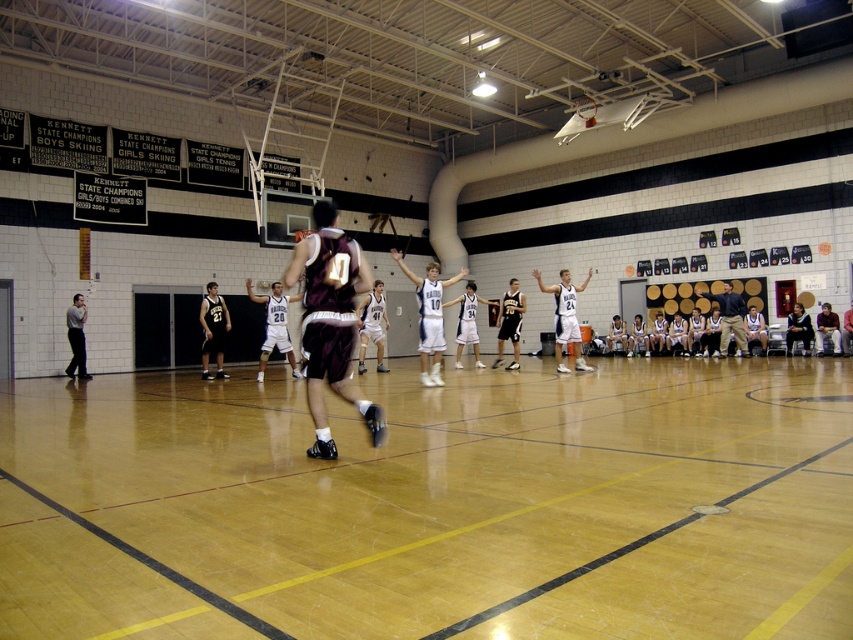
Question: Does wooden floor at center appear over matte black jersey at center?

Choices:
 (A) yes
 (B) no

Answer: (B)

Question: Is white jersey at center to the left of dark brown leather jacket at lower right from the viewer's perspective?

Choices:
 (A) yes
 (B) no

Answer: (A)

Question: Observing the image, what is the correct spatial positioning of dark blue shirt at right in reference to gray shirt at left?

Choices:
 (A) right
 (B) left

Answer: (A)

Question: Which of these objects is positioned closest to the white jersey at center?

Choices:
 (A) dark blue shirt at right
 (B) dark blue jersey at center
 (C) dark brown leather jacket at lower right

Answer: (A)

Question: Which point is closer to the camera taking this photo?

Choices:
 (A) (73, 305)
 (B) (720, 305)
 (C) (560, 342)

Answer: (C)

Question: Which point is closer to the camera taking this photo?

Choices:
 (A) (311, 332)
 (B) (68, 621)
 (C) (80, 362)

Answer: (B)